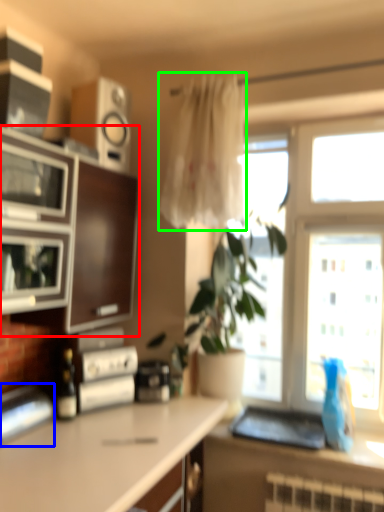
Question: Estimate the real-world distances between objects in this image. Which object is farther from cabinetry (highlighted by a red box), appliance (highlighted by a blue box) or curtain (highlighted by a green box)?

Choices:
 (A) appliance
 (B) curtain

Answer: (A)